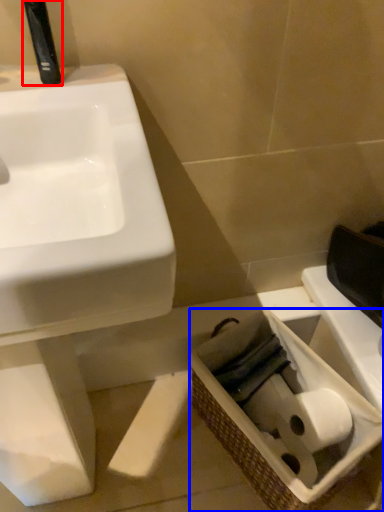
Question: Which object appears farthest to the camera in this image, plumbing fixture (highlighted by a red box) or basket (highlighted by a blue box)?

Choices:
 (A) plumbing fixture
 (B) basket

Answer: (B)